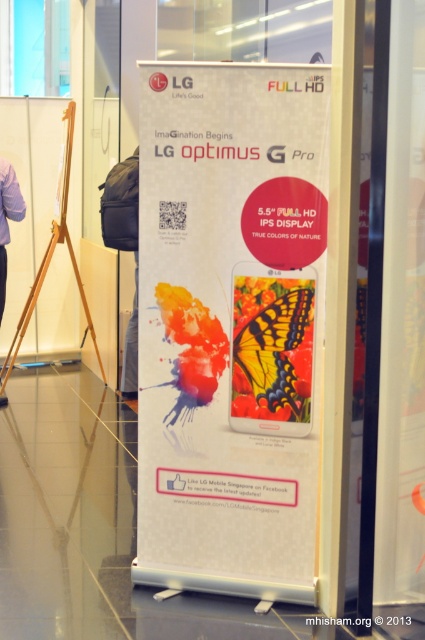
Does yellow matte butterfly at center have a larger size compared to purple fabric at left?

No, yellow matte butterfly at center is not bigger than purple fabric at left.

What do you see at coordinates (272, 348) in the screenshot? The height and width of the screenshot is (640, 425). I see `yellow matte butterfly at center` at bounding box center [272, 348].

Is point (292, 326) positioned behind point (22, 208)?

No, it is not.

The width and height of the screenshot is (425, 640). I want to click on yellow matte butterfly at center, so click(272, 348).

Between yellow matte butterfly at center and wooden tripod at left, which one has more height?

wooden tripod at left is taller.

Is point (297, 324) less distant than point (17, 330)?

Yes, point (297, 324) is closer to viewer.

At what (x,y) coordinates should I click in order to perform the action: click on yellow matte butterfly at center. Please return your answer as a coordinate pair (x, y). Image resolution: width=425 pixels, height=640 pixels. Looking at the image, I should click on (272, 348).

Can you confirm if white paper poster at center is positioned below wooden tripod at left?

Yes.

Can you confirm if white paper poster at center is positioned above wooden tripod at left?

Actually, white paper poster at center is below wooden tripod at left.

Is point (214, 280) behind point (81, 284)?

No, it is not.

At what (x,y) coordinates should I click in order to perform the action: click on white paper poster at center. Please return your answer as a coordinate pair (x, y). Looking at the image, I should click on (231, 324).